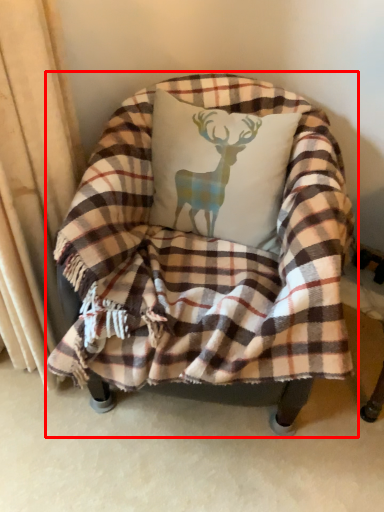
Question: From the image's perspective, considering the relative positions of chair (annotated by the red box) and throw pillow in the image provided, where is chair (annotated by the red box) located with respect to the staircase?

Choices:
 (A) below
 (B) above

Answer: (A)